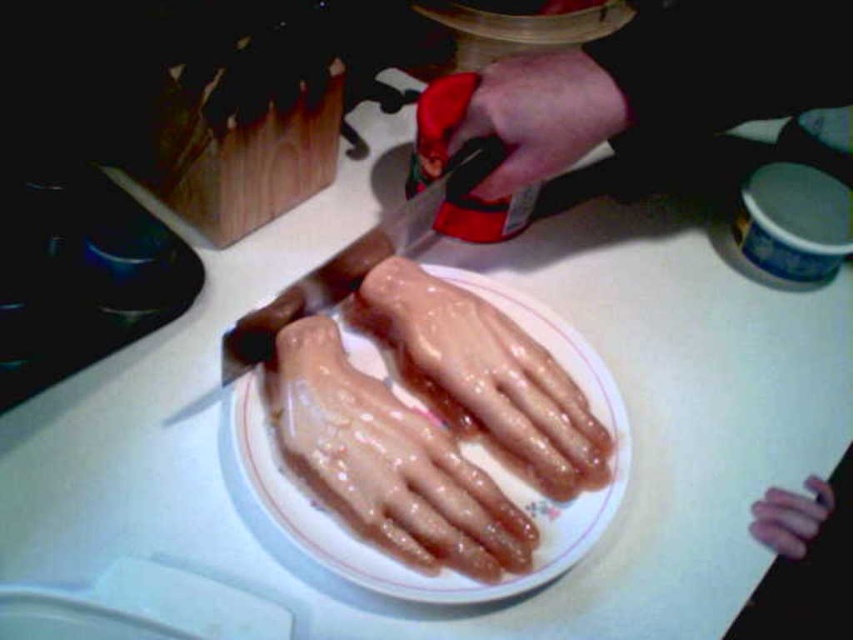
Question: Is glossy plastic hand at center thinner than pink rubber hand at center?

Choices:
 (A) yes
 (B) no

Answer: (B)

Question: Which point is closer to the camera?

Choices:
 (A) pink rubber hand at center
 (B) black plastic knife at center

Answer: (B)

Question: Estimate the real-world distances between objects in this image. Which object is farther from the black plastic knife at center?

Choices:
 (A) pink rubber hand at center
 (B) smooth pink hand at upper center
 (C) smooth skin hand at upper center

Answer: (A)

Question: Which of the following is the farthest from the observer?

Choices:
 (A) (548, 52)
 (B) (619, 29)
 (C) (614, 406)
 (D) (421, 296)

Answer: (A)

Question: Does glossy plastic hand at center come in front of black plastic knife at center?

Choices:
 (A) yes
 (B) no

Answer: (B)

Question: In this image, where is white glossy plate at center located relative to pink rubber hand at center?

Choices:
 (A) below
 (B) above

Answer: (B)